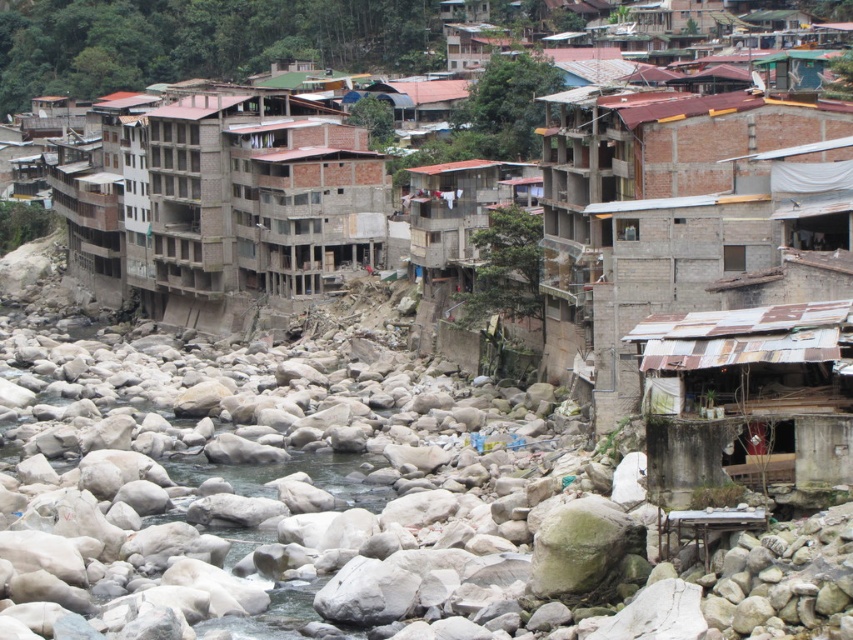
You are an urban planner assessing the riverfront area. You need to determine which of the two central buildings, the brown brick buildings at center or the brown concrete building at center, has a greater width to allocate space for a new pedestrian walkway. Which building is wider?

The brown brick buildings at center has a greater width than the brown concrete building at center, so the pedestrian walkway should be allocated near the brown brick buildings at center.

You are a construction worker planning to transport materials from the brown concrete building at center to the rusty corrugated metal hut at lower right. Given that your equipment can carry materials up to 80 meters, will you be able to complete the transport without needing additional equipment?

Result: The distance between the brown concrete building at center and the rusty corrugated metal hut at lower right is 79.52 meters. Since your equipment can carry materials up to 80 meters, you will be able to complete the transport without needing additional equipment.

You are a city planner evaluating the urban layout. Given the brown brick buildings at center and the rusty corrugated metal hut at lower right, which structure occupies more horizontal space in the scene?

The brown brick buildings at center occupy more horizontal space than the rusty corrugated metal hut at lower right because their width surpasses the latter.